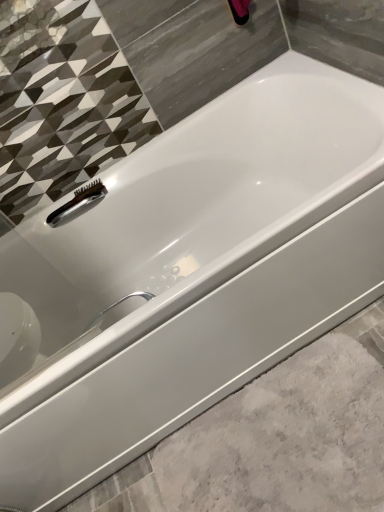
Find the location of a particular element. This screenshot has width=384, height=512. polished chrome faucet at left is located at coordinates (78, 201).

What do you see at coordinates (78, 201) in the screenshot? I see `polished chrome faucet at left` at bounding box center [78, 201].

This screenshot has width=384, height=512. I want to click on polished chrome faucet at left, so click(78, 201).